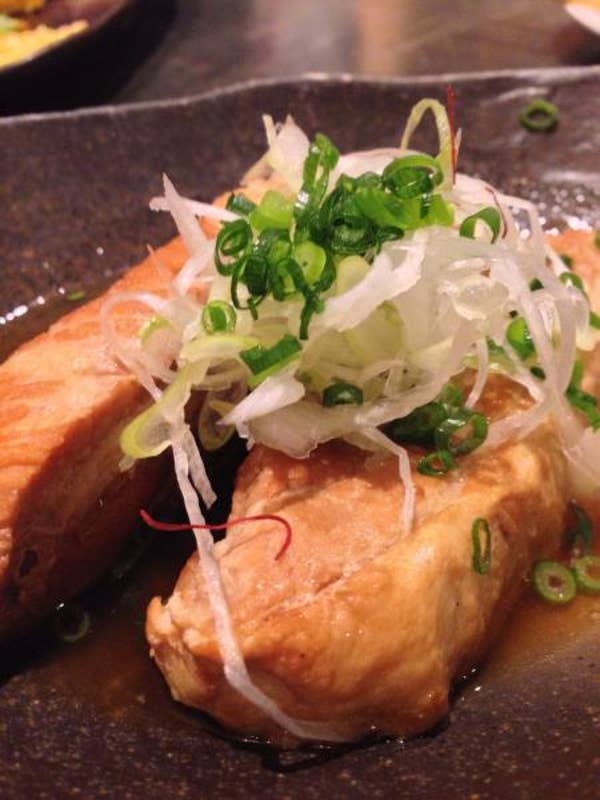
Locate an element on the screen. black plate is located at coordinates (53, 58).